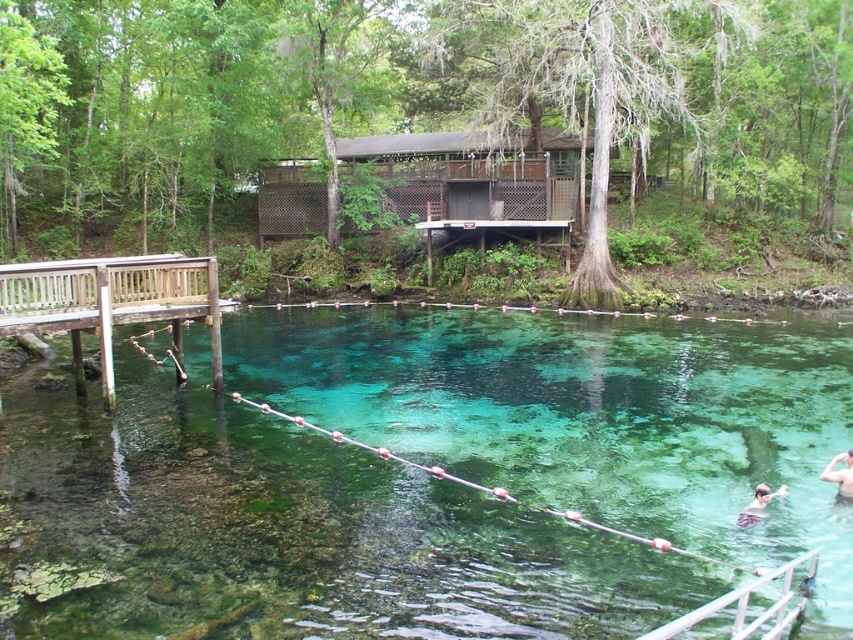
You are standing at the camera position and want to reach the point marked as point (6, 444) in the spring. The rope barrier on the dock is 10 meters long. Can you walk along the dock to reach that point without crossing the rope barrier?

The distance between you and point (6, 444) is 11.23 meters. Since the rope barrier is only 10 meters long, you would need to go beyond the barrier to reach the point, so you cannot reach it without crossing the rope barrier.